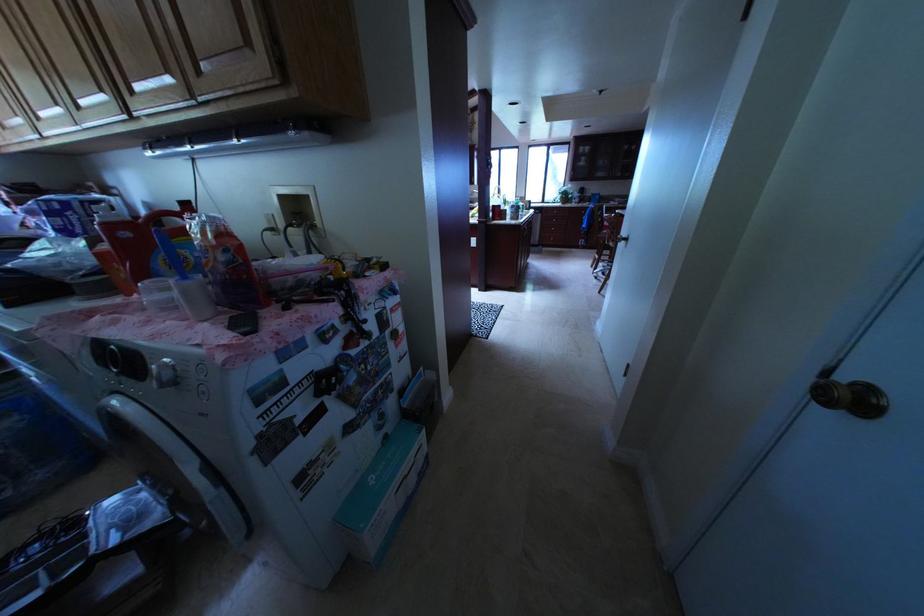
Find where to lift the red bottle handle. Please return your answer as a coordinate pair (x, y).

(849, 398)